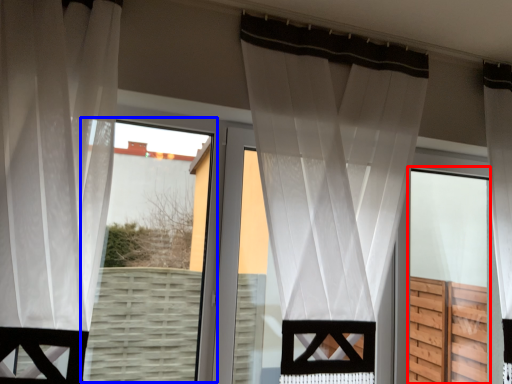
Question: Which point is closer to the camera, screen door (highlighted by a red box) or bay window (highlighted by a blue box)?

Choices:
 (A) screen door
 (B) bay window

Answer: (B)